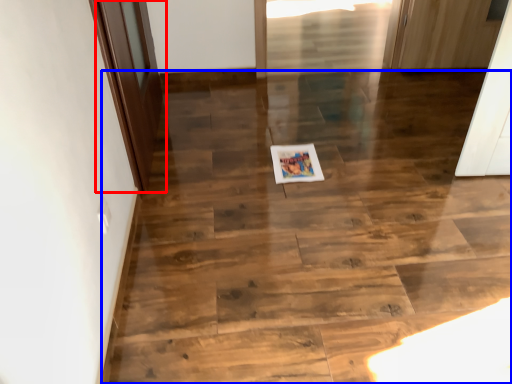
Question: Which object appears closest to the camera in this image, door (highlighted by a red box) or stairwell (highlighted by a blue box)?

Choices:
 (A) door
 (B) stairwell

Answer: (B)